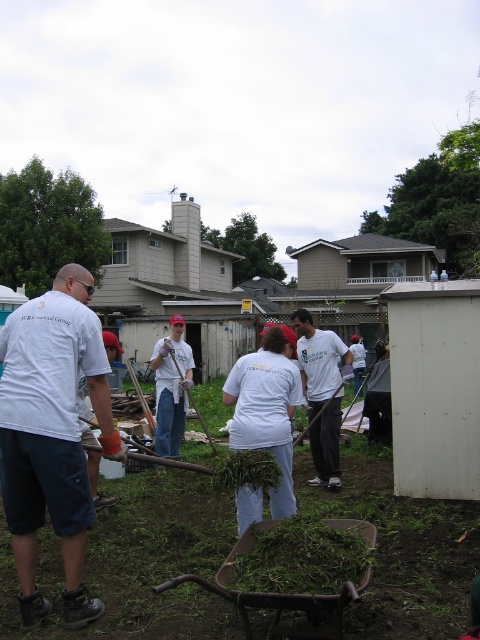
Question: Which object is farther from the camera taking this photo?

Choices:
 (A) white cotton shirt at left
 (B) green leafy grass at center
 (C) white cotton t-shirt at center
 (D) white cotton shirt at center

Answer: (D)

Question: Which point appears farthest from the camera in this image?

Choices:
 (A) (301, 372)
 (B) (29, 387)
 (C) (345, 616)

Answer: (A)

Question: Considering the relative positions of white cotton shirt at left and white cotton t-shirt at center in the image provided, where is white cotton shirt at left located with respect to white cotton t-shirt at center?

Choices:
 (A) below
 (B) above

Answer: (A)

Question: Does white cotton t-shirt at center come behind white cotton shirt at center?

Choices:
 (A) yes
 (B) no

Answer: (B)

Question: Can you confirm if green leafy grass at center is positioned above white cotton shirt at center?

Choices:
 (A) no
 (B) yes

Answer: (A)

Question: Among these points, which one is farthest from the camera?

Choices:
 (A) pos(322,420)
 (B) pos(172,392)
 (C) pos(3,416)
 (D) pos(381,592)

Answer: (B)